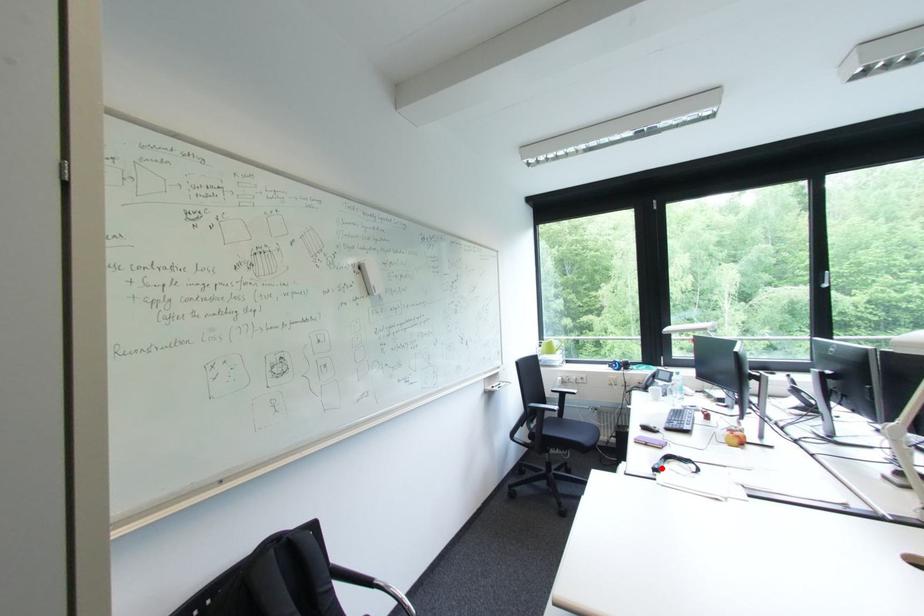
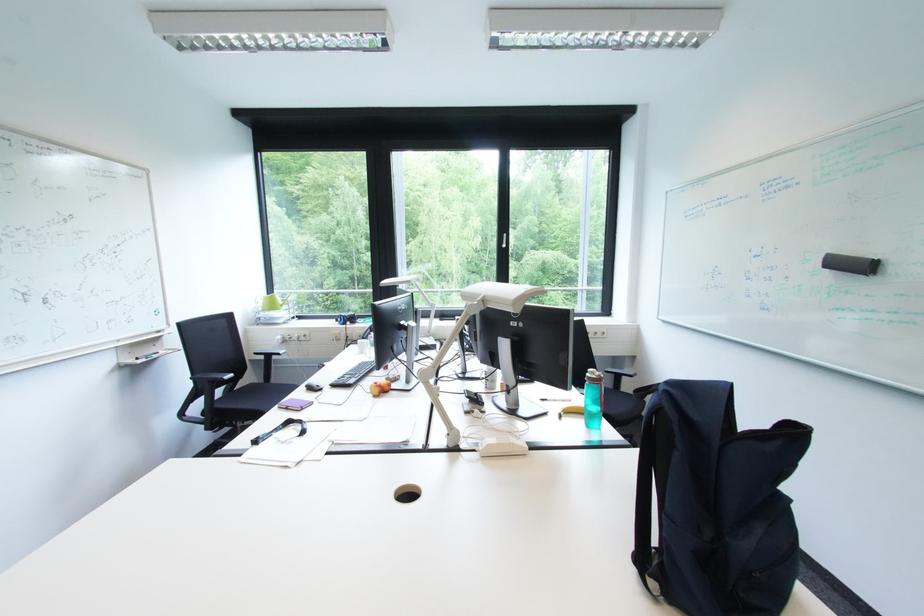
In the second image, find the point that corresponds to the highlighted location in the first image.

(262, 440)